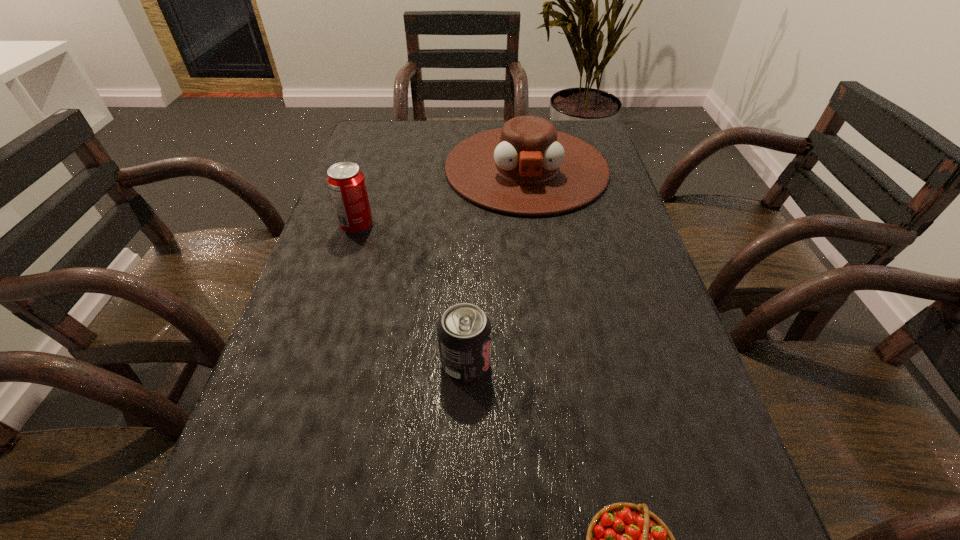
Where is `the taller soda can`? the taller soda can is located at coordinates (346, 183).

Locate an element on the screen. This screenshot has width=960, height=540. the tallest object is located at coordinates (346, 183).

You are a GUI agent. You are given a task and a screenshot of the screen. Output one action in this format:
    pyautogui.click(x=<x>, y=<y>)
    Task: Click on the cowboy hat
    This screenshot has width=960, height=540.
    Given the screenshot: What is the action you would take?
    pyautogui.click(x=528, y=168)

Locate an element on the screen. The height and width of the screenshot is (540, 960). the third farthest object is located at coordinates (464, 331).

This screenshot has width=960, height=540. I want to click on the nearer soda can, so click(x=464, y=331).

Where is `vacant space located on the front of the leftmost object`? vacant space located on the front of the leftmost object is located at coordinates (323, 334).

The width and height of the screenshot is (960, 540). What are the coordinates of `vacant space located on the front-facing side of the cowboy hat` in the screenshot? It's located at (548, 325).

You are a GUI agent. You are given a task and a screenshot of the screen. Output one action in this format:
    pyautogui.click(x=<x>, y=<y>)
    Task: Click on the free region located 0.280m on the back of the second nearest object
    This screenshot has width=960, height=540.
    Given the screenshot: What is the action you would take?
    pyautogui.click(x=468, y=242)

This screenshot has width=960, height=540. Find the location of `object at the far edge`. object at the far edge is located at coordinates (528, 168).

Identify the location of object that is at the left edge. The image size is (960, 540). (346, 183).